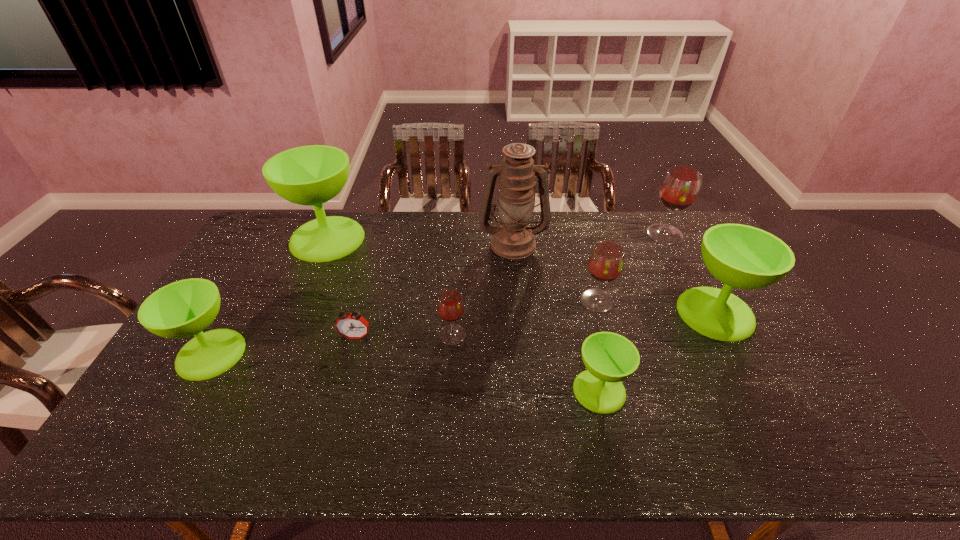
The height and width of the screenshot is (540, 960). Find the location of `empty location between the oil lamp and the biggest red wineglass`. empty location between the oil lamp and the biggest red wineglass is located at coordinates (588, 239).

The height and width of the screenshot is (540, 960). I want to click on free point between the smallest red wineglass and the seventh object from right to left, so click(x=404, y=336).

Find the location of a particular element. The height and width of the screenshot is (540, 960). free spot between the second red wineglass from right to left and the oil lamp is located at coordinates [555, 272].

This screenshot has height=540, width=960. Identify the location of unoccupied area between the third biggest green wineglass and the farthest green wineglass. (269, 296).

The width and height of the screenshot is (960, 540). Find the location of `vacant area between the farthest red wineglass and the third biggest green wineglass`. vacant area between the farthest red wineglass and the third biggest green wineglass is located at coordinates (438, 294).

You are a GUI agent. You are given a task and a screenshot of the screen. Output one action in this format:
    pyautogui.click(x=<x>, y=<y>)
    Task: Click on the free area in between the leftmost red wineglass and the third smallest green wineglass
    
    Given the screenshot: What is the action you would take?
    pyautogui.click(x=584, y=324)

The width and height of the screenshot is (960, 540). I want to click on free spot between the second tallest object and the shortest object, so [x=342, y=288].

Point out which object is positioned as the second nearest to the biggest green wineglass. Please provide its 2D coordinates. Your answer should be formatted as a tuple, i.e. [(x, y)], where the tuple contains the x and y coordinates of a point satisfying the conditions above.

[(350, 325)]

At what (x,y) coordinates should I click in order to perform the action: click on the eighth closest object to the third biggest green wineglass. Please return your answer as a coordinate pair (x, y). This screenshot has height=540, width=960. Looking at the image, I should click on (680, 187).

Point out which wineglass is positioned as the second nearest to the fourth object from left to right. Please provide its 2D coordinates. Your answer should be formatted as a tuple, i.e. [(x, y)], where the tuple contains the x and y coordinates of a point satisfying the conditions above.

[(606, 261)]